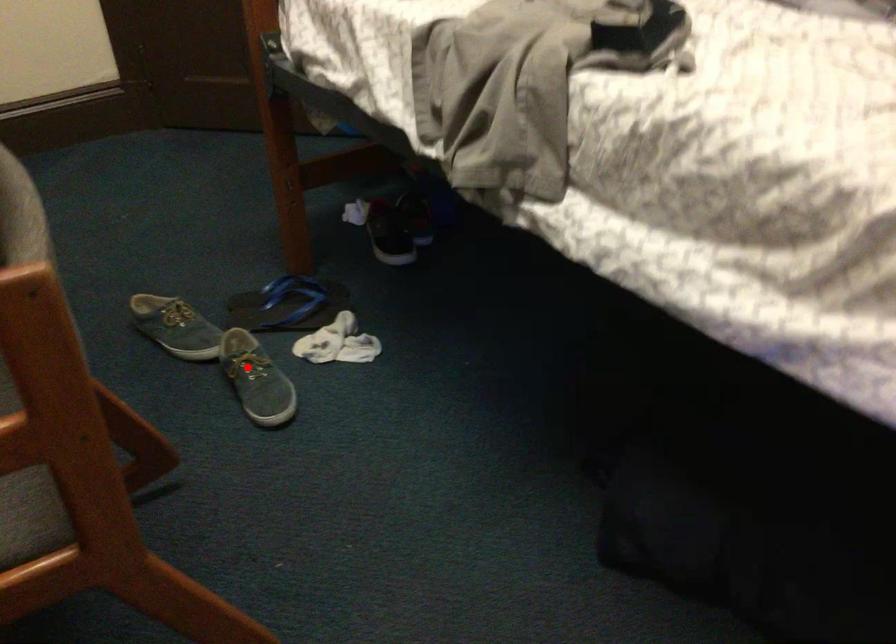
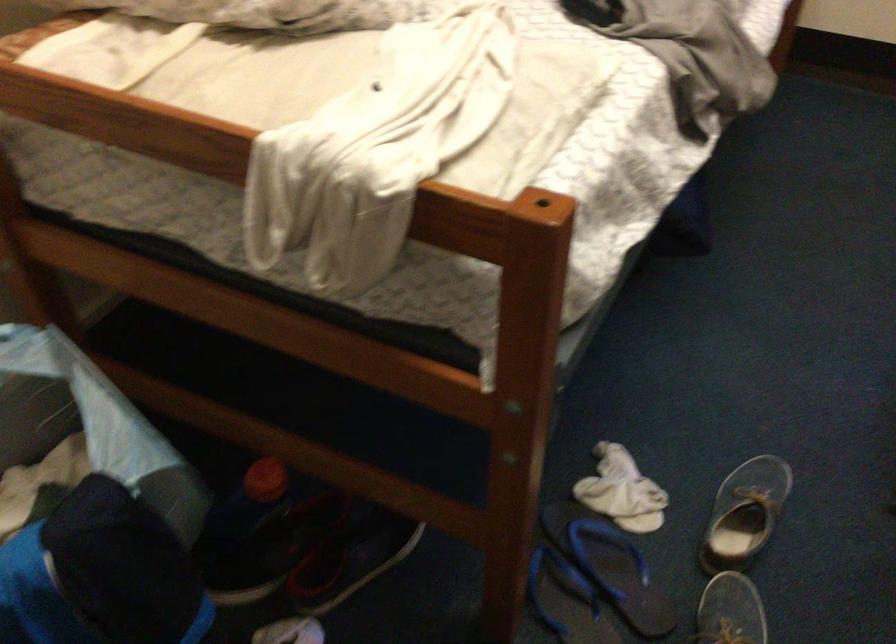
Question: I am providing you with two images of the same scene from different viewpoints. Given a red point in image1, look at the same physical point in image2. Is it:

Choices:
 (A) Closer to the viewpoint
 (B) Farther from the viewpoint

Answer: (A)